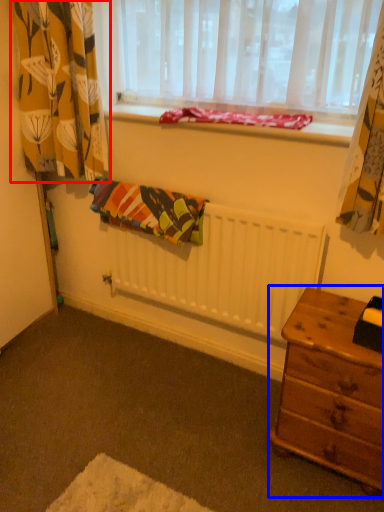
Question: Among these objects, which one is farthest to the camera, curtain (highlighted by a red box) or nightstand (highlighted by a blue box)?

Choices:
 (A) curtain
 (B) nightstand

Answer: (A)